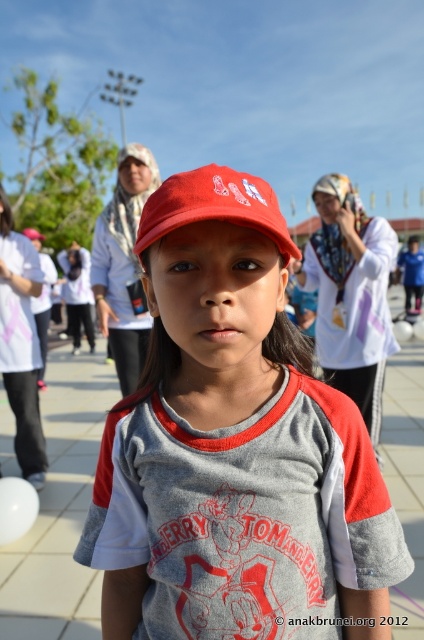
Question: From the image, what is the correct spatial relationship of matte red cap at center in relation to matte red baseball cap at center?

Choices:
 (A) below
 (B) above

Answer: (A)

Question: Can you confirm if matte red cap at center is wider than matte red baseball cap at center?

Choices:
 (A) no
 (B) yes

Answer: (B)

Question: Can you confirm if matte red cap at center is smaller than matte red baseball cap at center?

Choices:
 (A) yes
 (B) no

Answer: (B)